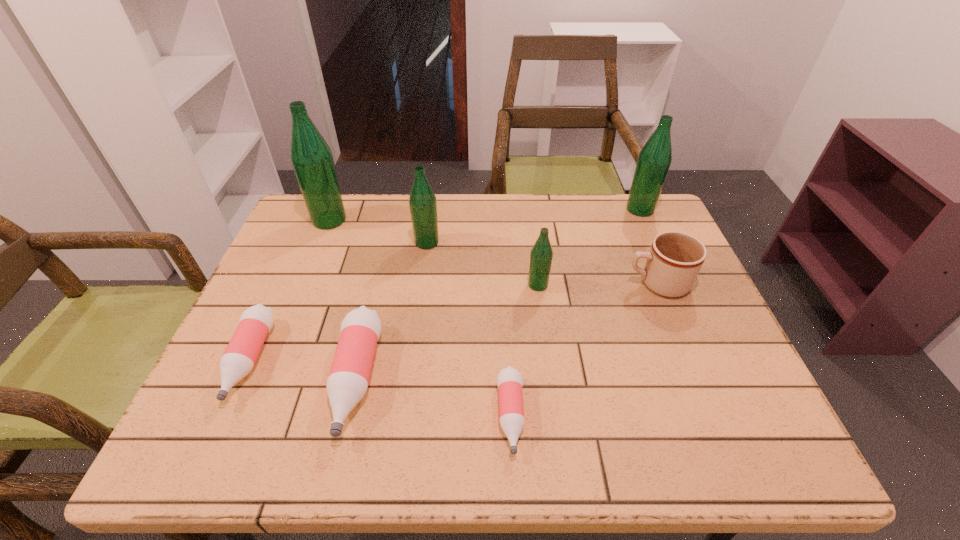
Image resolution: width=960 pixels, height=540 pixels. Find the location of `the fifth bottle from right to left`. the fifth bottle from right to left is located at coordinates (347, 383).

The height and width of the screenshot is (540, 960). Identify the location of the sixth tallest object. (347, 383).

You are a GUI agent. You are given a task and a screenshot of the screen. Output one action in this format:
    pyautogui.click(x=<x>, y=<y>)
    Task: Click on the leftmost pink bottle
    
    Given the screenshot: What is the action you would take?
    pyautogui.click(x=255, y=323)

Where is `the seventh tallest object`? The image size is (960, 540). the seventh tallest object is located at coordinates (255, 323).

Find the location of a particular element. The image size is (960, 540). the rightmost pink bottle is located at coordinates (511, 410).

This screenshot has height=540, width=960. Identify the location of the shortest object. (511, 410).

What are the coordinates of `blank space located on the front of the tallest bottle` in the screenshot? It's located at (315, 255).

The width and height of the screenshot is (960, 540). Identify the location of free space located on the front of the second tallest object. [669, 274].

Locate an element on the screen. The width and height of the screenshot is (960, 540). blank space located on the front of the third green bottle from right to left is located at coordinates (418, 315).

Identify the location of vacant space situated 0.270m on the back of the third green bottle from left to right. This screenshot has width=960, height=540. (529, 217).